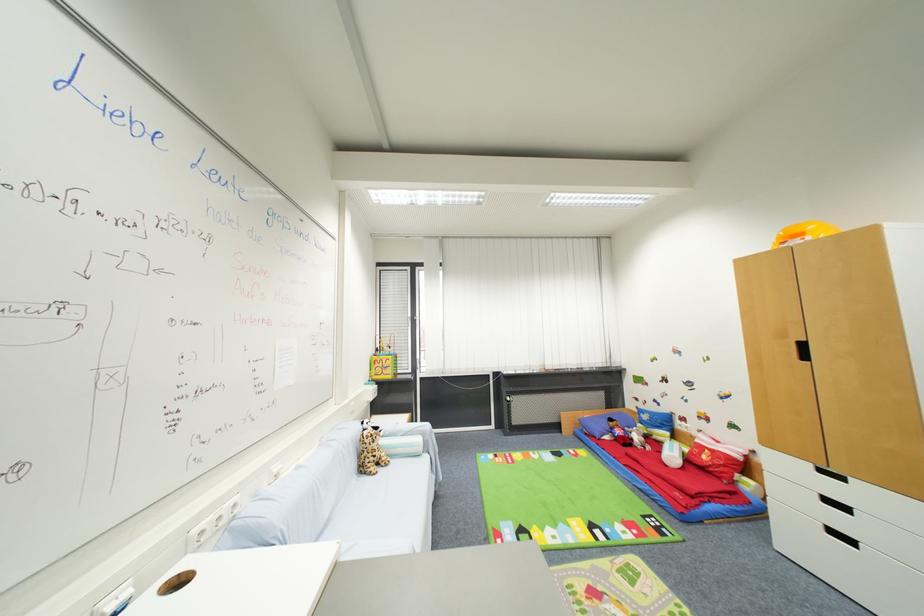
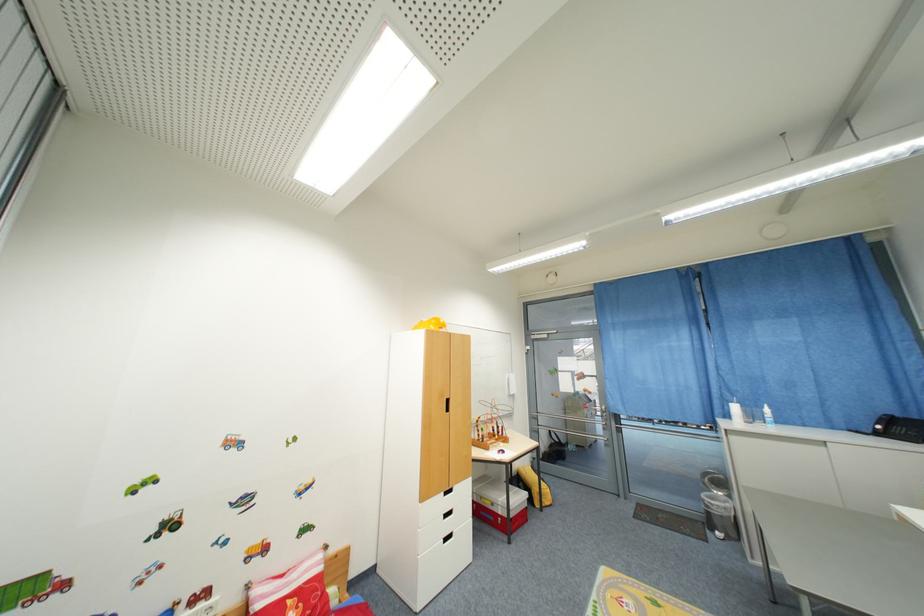
Locate, in the second image, the point that corresponds to point 849,509 in the first image.

(458, 514)